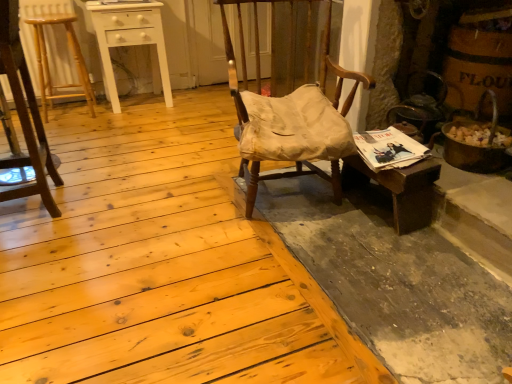
Identify the location of free space in front of light brown wood bar stool at left. (71, 129).